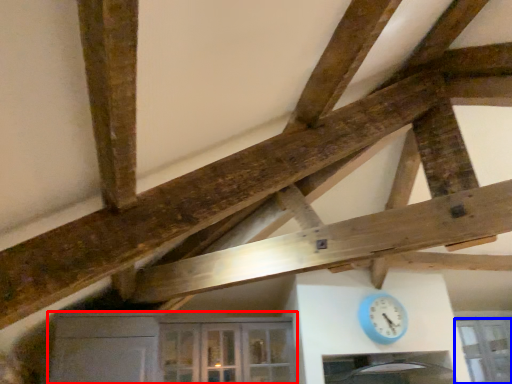
Question: Which point is closer to the camera, cabinetry (highlighted by a red box) or window (highlighted by a blue box)?

Choices:
 (A) cabinetry
 (B) window

Answer: (A)